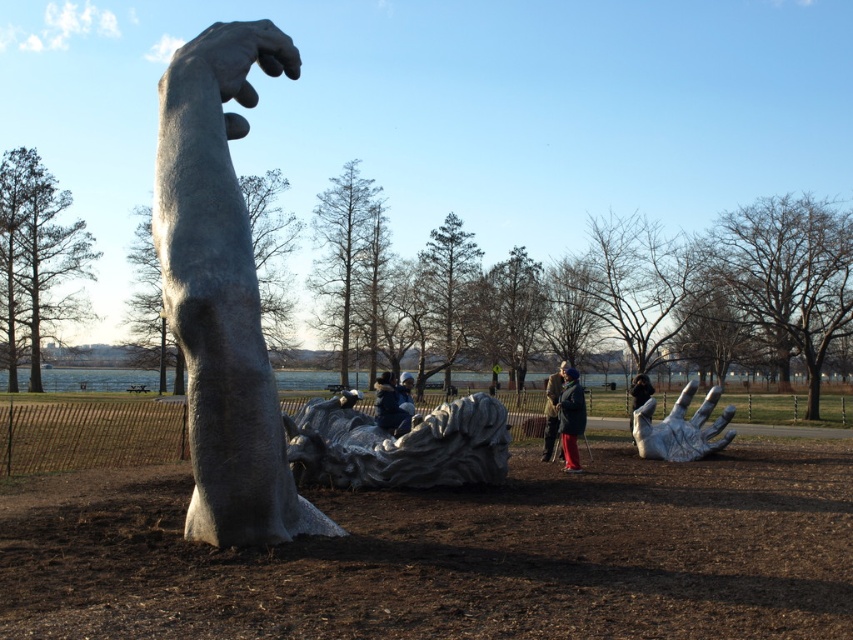
Question: In this image, where is sanded stone hand at upper center located relative to blue denim jacket at center?

Choices:
 (A) left
 (B) right

Answer: (A)

Question: Can you confirm if polished silver sculpture at center is wider than dark blue jacket at center?

Choices:
 (A) yes
 (B) no

Answer: (A)

Question: Which point appears farthest from the camera in this image?

Choices:
 (A) (645, 412)
 (B) (335, 440)

Answer: (A)

Question: Does polished stone sculpture at center have a larger size compared to sanded stone hand at upper center?

Choices:
 (A) no
 (B) yes

Answer: (B)

Question: Based on their relative distances, which object is farther from the black fabric jacket at lower right?

Choices:
 (A) dark brown leather jacket at center
 (B) silver metallic hand at lower right
 (C) polished stone hand at center
 (D) polished silver sculpture at center

Answer: (C)

Question: Which point is closer to the camera taking this photo?

Choices:
 (A) (231, 369)
 (B) (379, 378)
 (C) (213, 29)

Answer: (A)